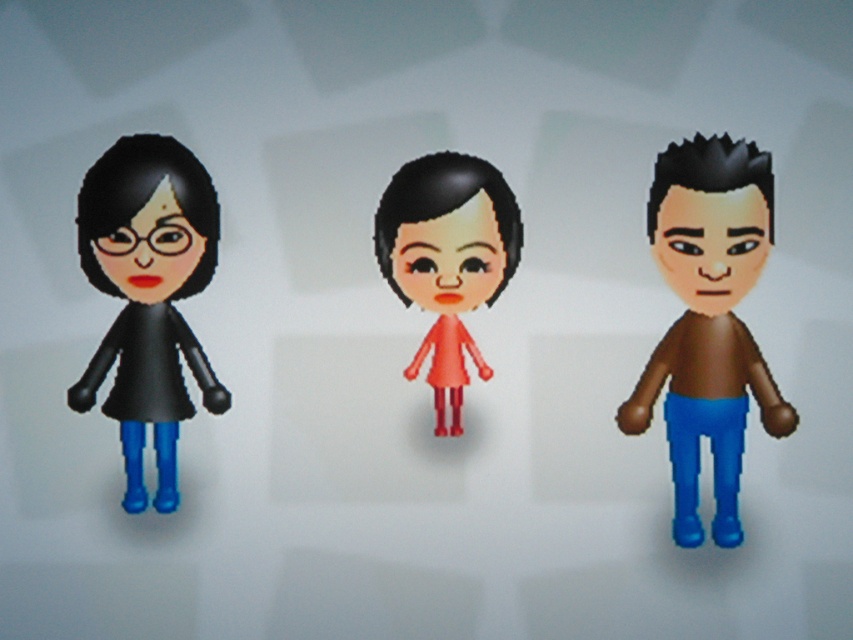
Is point (137, 144) behind point (462, 202)?

No, (137, 144) is in front of (462, 202).

Which is above, black matte doll at left or black matte hair at center?

black matte hair at center

Is point (109, 269) more distant than point (439, 209)?

Yes, point (109, 269) is behind point (439, 209).

This screenshot has width=853, height=640. Find the location of `black matte doll at left`. black matte doll at left is located at coordinates (148, 296).

How far apart are brown matte shirt at right and dark brown spiky hair at right?

Result: 4.25 inches

Can you confirm if brown matte shirt at right is taller than dark brown spiky hair at right?

Yes.

Is point (728, 436) closer to viewer compared to point (728, 179)?

No, (728, 436) is further to viewer.

Find the location of a particular element. This screenshot has width=853, height=640. brown matte shirt at right is located at coordinates click(708, 321).

Is point (178, 413) behind point (163, 150)?

That is True.

Is black matte doll at left to the left of black matte hair at left from the viewer's perspective?

Indeed, black matte doll at left is positioned on the left side of black matte hair at left.

Is point (119, 204) less distant than point (154, 172)?

That is False.

Find the location of `black matte doll at left`. black matte doll at left is located at coordinates (148, 296).